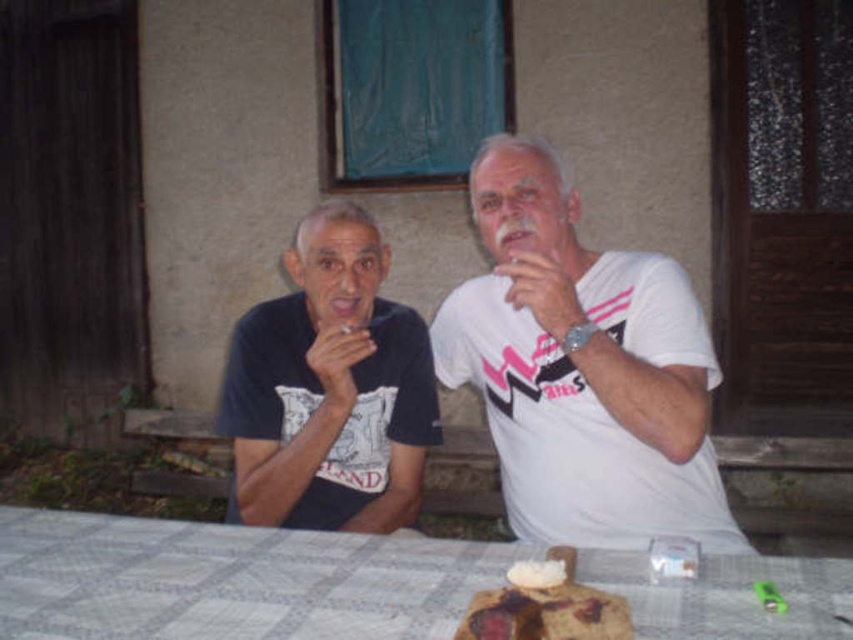
Can you confirm if white fabric table at center is taller than black matte t-shirt at center?

Incorrect, white fabric table at center's height is not larger of black matte t-shirt at center's.

Can you confirm if white fabric table at center is positioned to the right of black matte t-shirt at center?

Correct, you'll find white fabric table at center to the right of black matte t-shirt at center.

Where is `white fabric table at center`? Image resolution: width=853 pixels, height=640 pixels. white fabric table at center is located at coordinates (230, 580).

Does point (399, 332) lie in front of point (519, 570)?

No, (399, 332) is behind (519, 570).

Looking at this image, which is below, black matte t-shirt at center or white crumbly cake at center?

Positioned lower is white crumbly cake at center.

Who is more distant from viewer, (280, 330) or (622, 602)?

Point (280, 330)

Identify the location of black matte t-shirt at center. (329, 388).

Is white matte t-shirt at center taller than white fabric table at center?

Yes.

Does white matte t-shirt at center appear on the right side of white fabric table at center?

Yes, white matte t-shirt at center is to the right of white fabric table at center.

Who is more distant from viewer, (x=642, y=326) or (x=344, y=596)?

Point (x=642, y=326)

Locate an element on the screen. white matte t-shirt at center is located at coordinates (582, 369).